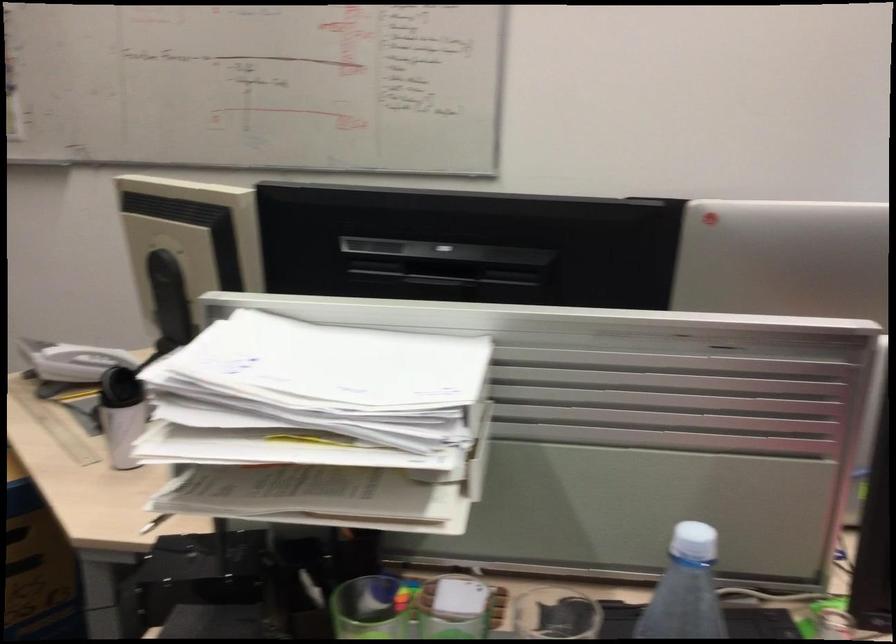
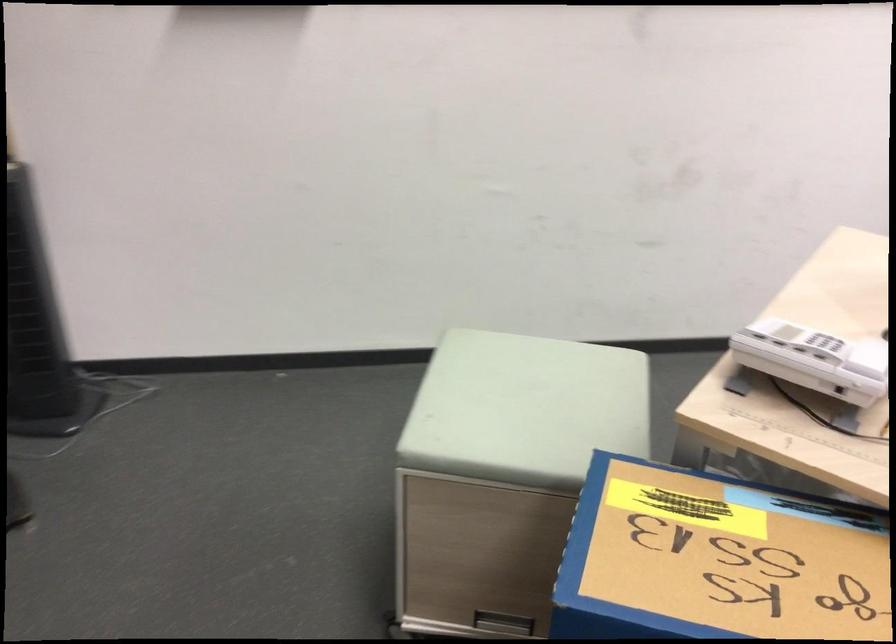
In a continuous first-person perspective shot, in which direction is the camera moving?

The cameraman walked toward left, forward.